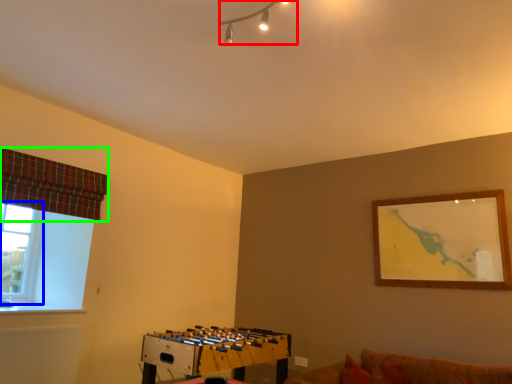
Question: Which is nearer to the lamp (highlighted by a red box)? window (highlighted by a blue box) or curtain (highlighted by a green box).

Choices:
 (A) window
 (B) curtain

Answer: (B)